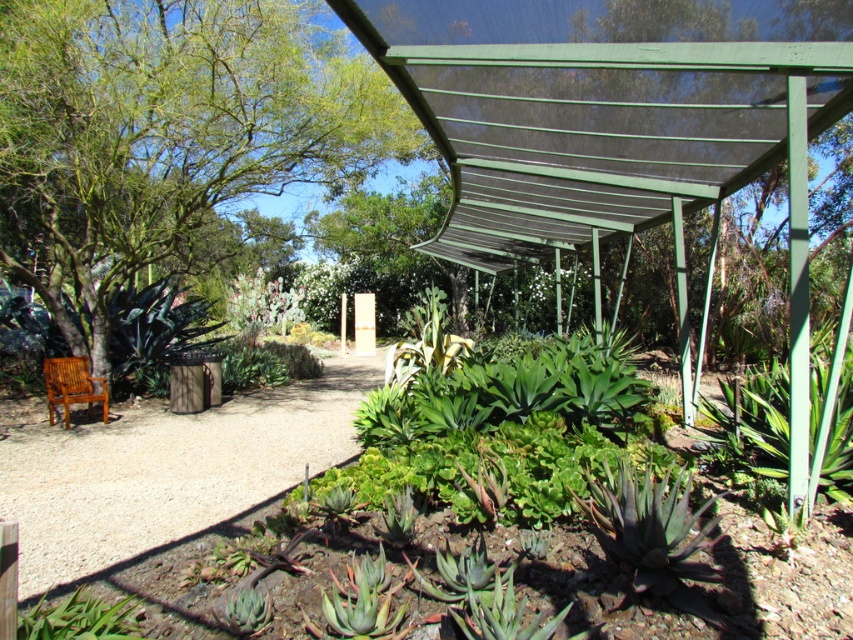
Question: Which object is closer to the camera taking this photo?

Choices:
 (A) green leafy tree at left
 (B) gravel path at center
 (C) teak wood park bench at lower left

Answer: (B)

Question: Estimate the real-world distances between objects in this image. Which object is farther from the green leafy tree at left?

Choices:
 (A) teak wood park bench at lower left
 (B) gravel path at center

Answer: (B)

Question: Which is farther from the green leafy tree at left?

Choices:
 (A) gravel path at center
 (B) teak wood park bench at lower left

Answer: (A)

Question: Can you confirm if green leafy tree at left is positioned to the right of gravel path at center?

Choices:
 (A) yes
 (B) no

Answer: (A)

Question: Is green leafy tree at left in front of teak wood park bench at lower left?

Choices:
 (A) no
 (B) yes

Answer: (A)

Question: Is gravel path at center behind teak wood park bench at lower left?

Choices:
 (A) no
 (B) yes

Answer: (A)